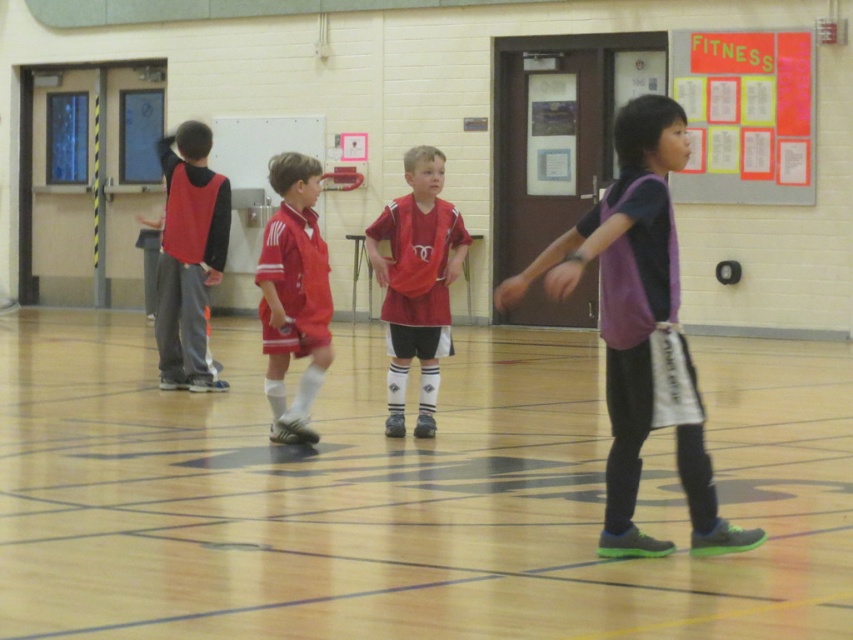
Is bright pink paper at upper right below matte red soccer uniform at center?

Actually, bright pink paper at upper right is above matte red soccer uniform at center.

Is bright pink paper at upper right taller than matte red soccer uniform at center?

Indeed, bright pink paper at upper right has a greater height compared to matte red soccer uniform at center.

This screenshot has height=640, width=853. Find the location of `bright pink paper at upper right`. bright pink paper at upper right is located at coordinates (746, 115).

What do you see at coordinates (625, 294) in the screenshot? The image size is (853, 640). I see `purple matte jersey at right` at bounding box center [625, 294].

Which is more to the left, purple matte jersey at right or matte red soccer uniform at center?

matte red soccer uniform at center is more to the left.

Who is more distant from viewer, (614, 358) or (274, 243)?

Positioned behind is point (274, 243).

This screenshot has height=640, width=853. What are the coordinates of `purple matte jersey at right` in the screenshot? It's located at tap(625, 294).

Does matte red soccer uniform at center lie in front of matte red jersey at left?

Yes, it is in front of matte red jersey at left.

Is point (329, 300) positioned before point (209, 136)?

That is True.

Identify the location of matte red soccer uniform at center. The height and width of the screenshot is (640, 853). coord(293,294).